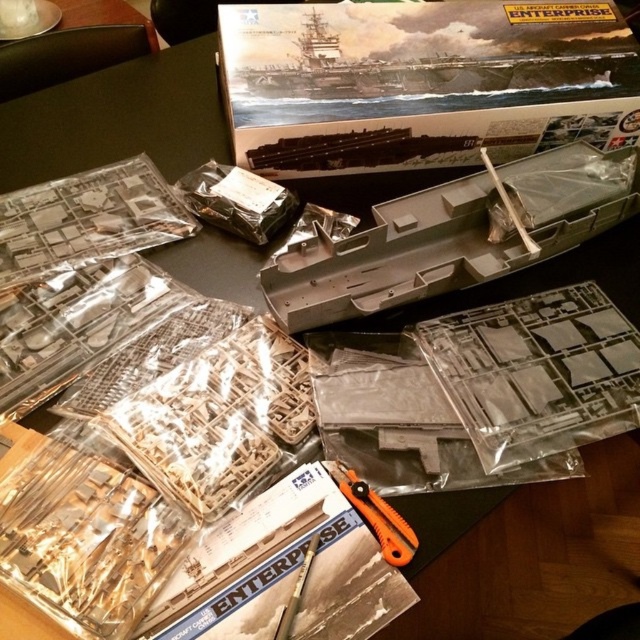
Between point (452, 243) and point (400, 534), which one is positioned behind?

The point (452, 243) is behind.

Is point (582, 218) behind point (390, 545)?

Yes, it is.

You are a GUI agent. You are given a task and a screenshot of the screen. Output one action in this format:
    pyautogui.click(x=<x>, y=<y>)
    Task: Click on the gray plastic boat at center
    The width and height of the screenshot is (640, 640).
    Given the screenshot: What is the action you would take?
    pyautogui.click(x=452, y=236)